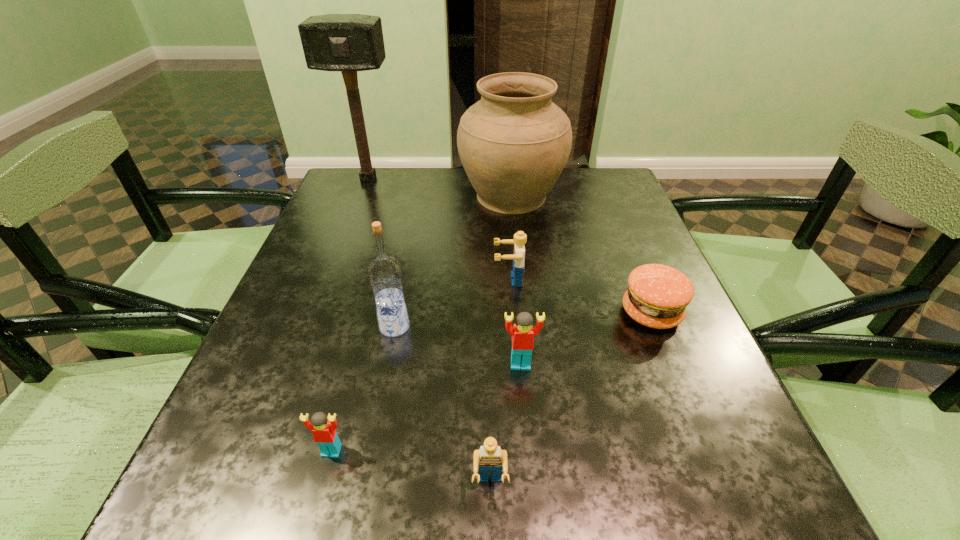
Find the location of a particular element. free space at the left edge of the desktop is located at coordinates (357, 280).

This screenshot has height=540, width=960. Identify the location of vacant space at the right edge of the desktop. coord(647,434).

Identify the location of vacant region at the far left corner. The height and width of the screenshot is (540, 960). (345, 202).

Locate an element on the screen. vacant space at the far right corner of the desktop is located at coordinates (617, 192).

At what (x,y) coordinates should I click in order to perform the action: click on free space that is in between the nearest Lego and the seventh shortest object. Please return your answer as a coordinate pair (x, y). This screenshot has width=960, height=540. Looking at the image, I should click on (500, 341).

Where is `vacant space in between the farther red Lego and the patty`? vacant space in between the farther red Lego and the patty is located at coordinates (586, 339).

This screenshot has height=540, width=960. Identify the location of vacant space that's between the bigger red Lego and the nearest Lego. (505, 424).

I want to click on vacant space that is in between the tallest object and the nearer blue Lego, so click(x=429, y=332).

Where is `vacant area between the third nearest Lego and the mallet`? vacant area between the third nearest Lego and the mallet is located at coordinates (444, 271).

This screenshot has height=540, width=960. Identify the location of empty space between the right red Lego and the sixth shortest object. (458, 345).